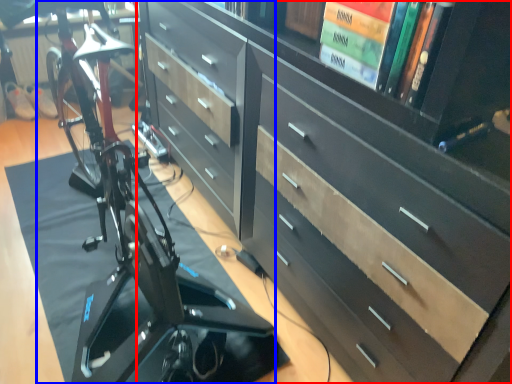
Question: Which object is closer to the camera taking this photo, chest of drawers (highlighted by a red box) or bicycle (highlighted by a blue box)?

Choices:
 (A) chest of drawers
 (B) bicycle

Answer: (A)